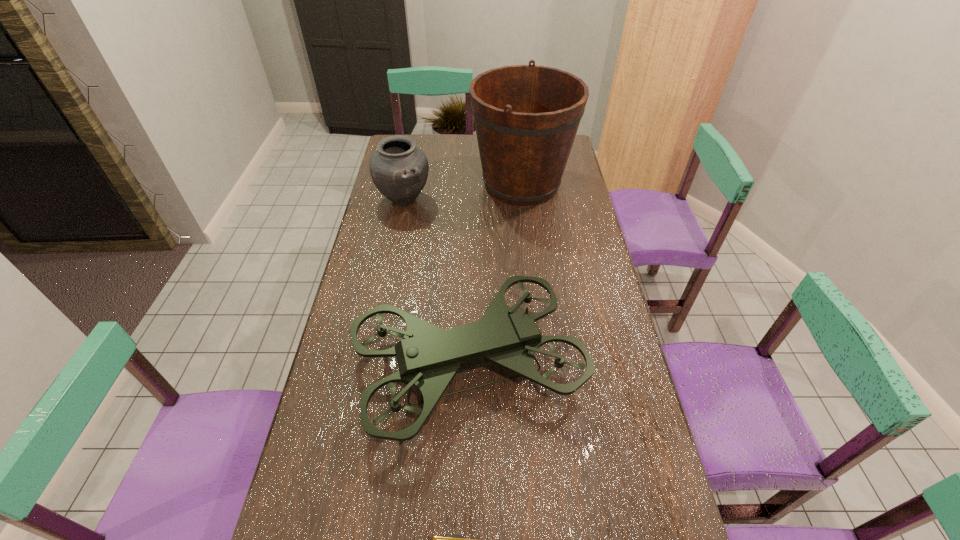
This screenshot has height=540, width=960. In order to click on the tallest object in this screenshot , I will do `click(526, 117)`.

This screenshot has width=960, height=540. Identify the location of drone. (428, 357).

The height and width of the screenshot is (540, 960). Find the location of `the third farthest object`. the third farthest object is located at coordinates (428, 357).

Identify the location of urn. (399, 169).

The image size is (960, 540). Find the location of `vacant area situated on the left of the tallest object`. vacant area situated on the left of the tallest object is located at coordinates (408, 184).

This screenshot has height=540, width=960. In order to click on vacant space located on the back of the third farthest object in this screenshot , I will do `click(471, 260)`.

The image size is (960, 540). I want to click on vacant space located 0.200m on the front of the second shortest object, so click(x=394, y=253).

Where is `object that is positioned at the far edge`? The width and height of the screenshot is (960, 540). object that is positioned at the far edge is located at coordinates (526, 117).

Find the location of `drone present at the left edge`. drone present at the left edge is located at coordinates (428, 357).

Where is `urn that is at the left edge`? The width and height of the screenshot is (960, 540). urn that is at the left edge is located at coordinates (399, 169).